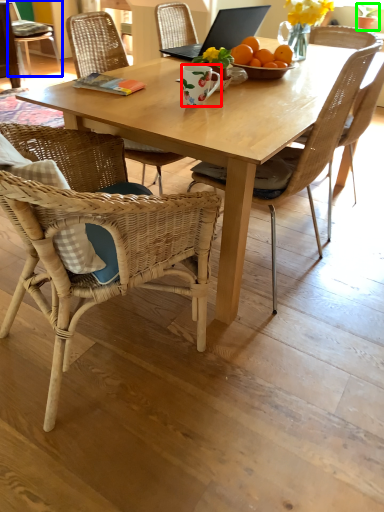
Question: Which object is positioned farthest from coffee cup (highlighted by a red box)? Select from chair (highlighted by a blue box) and houseplant (highlighted by a green box).

Choices:
 (A) chair
 (B) houseplant

Answer: (A)